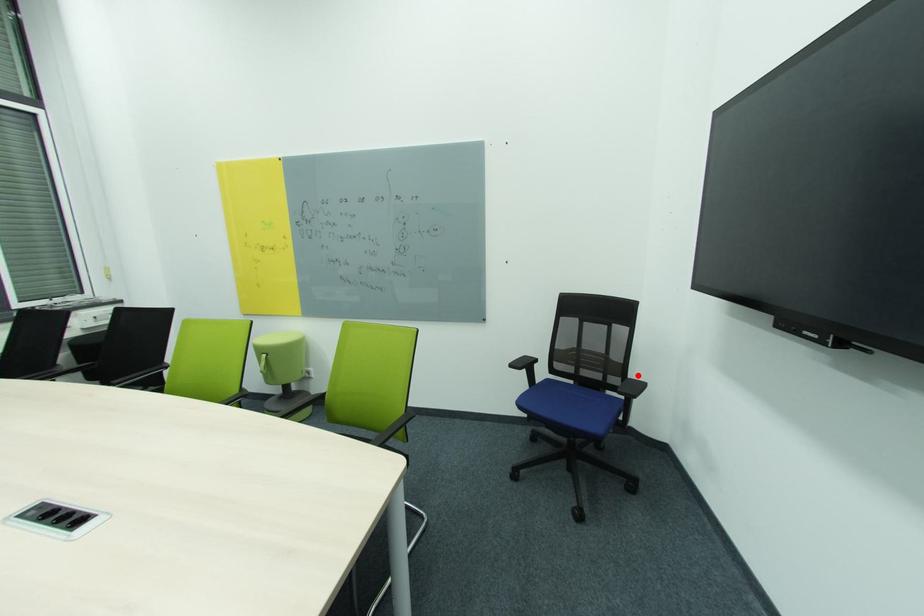
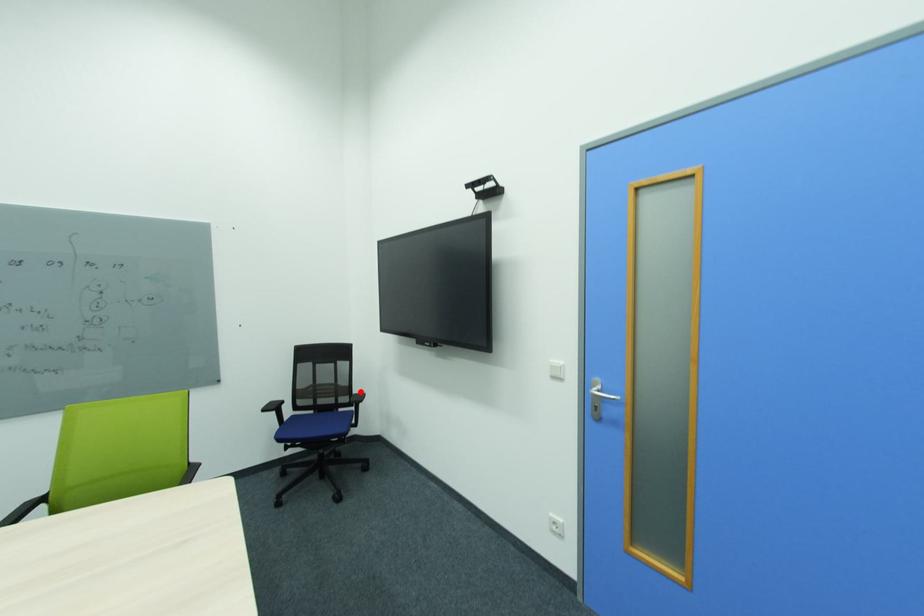
I am providing you with two images of the same scene from different viewpoints. A red point is marked on the first image and another point is marked on the second image. Is the marked point in image1 the same physical position as the marked point in image2?

Yes